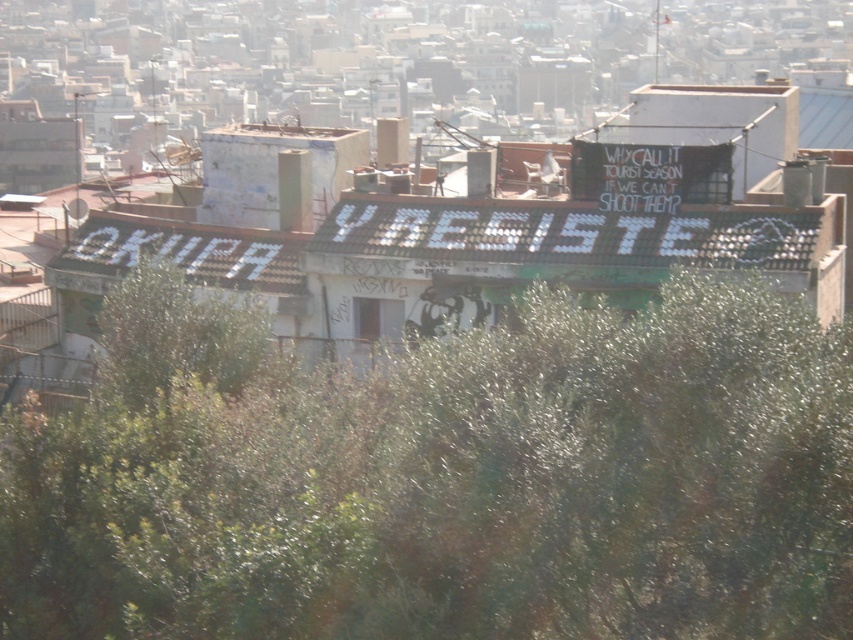
Can you confirm if green leafy tree at center is positioned below white tile roof at center?

Correct, green leafy tree at center is located below white tile roof at center.

Can you confirm if green leafy tree at center is positioned above white tile roof at center?

No.

Identify the location of green leafy tree at center. (442, 477).

Between point (660, 246) and point (253, 269), which one is positioned behind?

The point (253, 269) is more distant.

Between white tile roof at center and white corrugated metal roof at center, which one appears on the left side from the viewer's perspective?

Positioned to the left is white corrugated metal roof at center.

What do you see at coordinates (567, 232) in the screenshot? Image resolution: width=853 pixels, height=640 pixels. I see `white tile roof at center` at bounding box center [567, 232].

The image size is (853, 640). I want to click on white tile roof at center, so click(x=567, y=232).

Does point (566, 589) lie behind point (120, 269)?

No.

Does green leafy tree at center appear on the right side of white corrugated metal roof at center?

Correct, you'll find green leafy tree at center to the right of white corrugated metal roof at center.

Who is more distant from viewer, (x=310, y=374) or (x=264, y=266)?

Point (x=264, y=266)

Locate an element on the screen. green leafy tree at center is located at coordinates (442, 477).